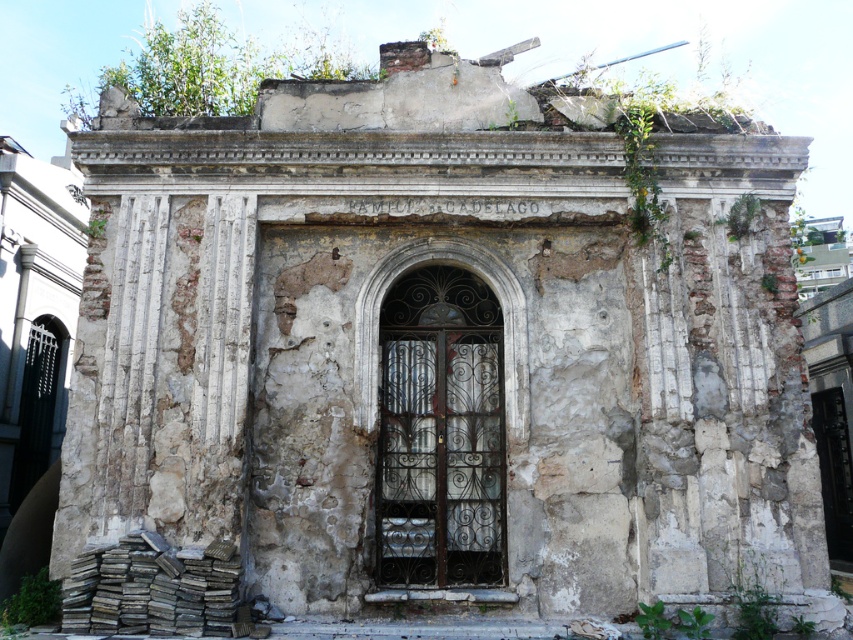
Is point (57, 582) behind point (746, 209)?

No.

Who is lower down, green leafy vegetation at lower left or green leafy plant at upper right?

green leafy vegetation at lower left

Is point (56, 588) farther from viewer compared to point (729, 230)?

No, it is not.

This screenshot has height=640, width=853. I want to click on green leafy vegetation at lower left, so click(32, 600).

Does green leafy vegetation at lower left appear on the right side of green leafy weed at lower right?

Incorrect, green leafy vegetation at lower left is not on the right side of green leafy weed at lower right.

Consider the image. Who is more distant from viewer, (x=35, y=596) or (x=662, y=627)?

Positioned behind is point (x=35, y=596).

This screenshot has width=853, height=640. What do you see at coordinates (32, 600) in the screenshot?
I see `green leafy vegetation at lower left` at bounding box center [32, 600].

The width and height of the screenshot is (853, 640). Find the location of `green leafy vegetation at lower left`. green leafy vegetation at lower left is located at coordinates (32, 600).

Is green leafy plant at upper right shorter than green leafy weed at lower right?

Incorrect, green leafy plant at upper right's height does not fall short of green leafy weed at lower right's.

Can you confirm if green leafy plant at upper right is thinner than green leafy weed at lower right?

Incorrect, green leafy plant at upper right's width is not less than green leafy weed at lower right's.

Find the location of `green leafy plant at upper right`. green leafy plant at upper right is located at coordinates (740, 216).

In order to click on green leafy plant at upper right in this screenshot , I will do `click(740, 216)`.